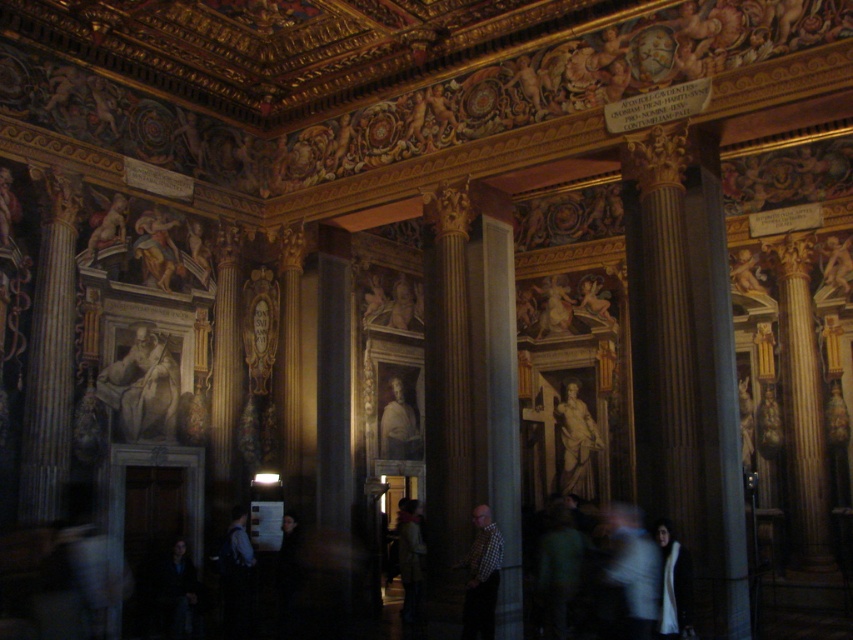
Can you confirm if brown polished wood column at center is positioned above matte gray figure at center-left?

Yes.

Between point (440, 468) and point (170, 353), which one is positioned in front?

Point (440, 468)

Image resolution: width=853 pixels, height=640 pixels. What are the coordinates of `brown polished wood column at center` in the screenshot? It's located at (448, 388).

Does brown polished wood column at center have a larger size compared to smooth gray statue at center?

Yes, brown polished wood column at center is bigger than smooth gray statue at center.

Which is behind, point (468, 492) or point (569, 458)?

The point (569, 458) is more distant.

Identify the location of brown polished wood column at center. Image resolution: width=853 pixels, height=640 pixels. (448, 388).

Can you confirm if white cotton shirt at center is positioned to the right of white wool scarf at lower right?

Correct, you'll find white cotton shirt at center to the right of white wool scarf at lower right.

Which is in front, point (611, 536) or point (683, 556)?

Point (683, 556)

You are a GUI agent. You are given a task and a screenshot of the screen. Output one action in this format:
    pyautogui.click(x=<x>, y=<y>)
    Task: Click on the white cotton shirt at center
    
    Given the screenshot: What is the action you would take?
    click(x=634, y=568)